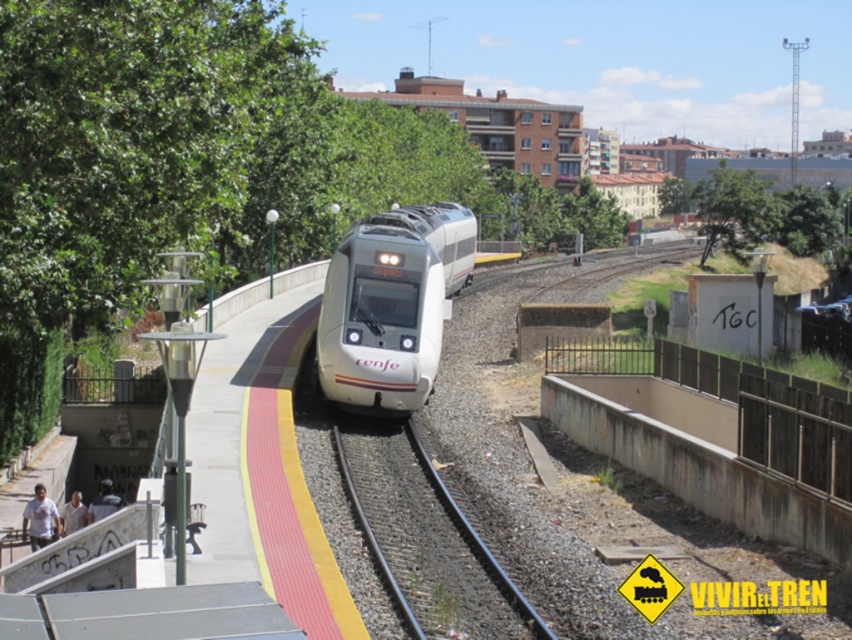
You are a maintenance worker checking the train station. You need to determine which object between the black metal train track at center and the green leafy tree at upper right is taller. Which one is taller?

The green leafy tree at upper right is taller than the black metal train track at center.

Consider the image. You are a passenger waiting at the train station and see the white glossy bullet train at center and the green leafy tree at upper right. Which object is closer to the left side of the platform?

The white glossy bullet train at center is closer to the left side of the platform since it is positioned to the left of the green leafy tree at upper right.

You are a passenger standing on the platform and see the white glossy bullet train at center and the black metal train track at center. Which object is positioned to the right side?

The white glossy bullet train at center is to the right of the black metal train track at center, so the white glossy bullet train at center is positioned to the right side.